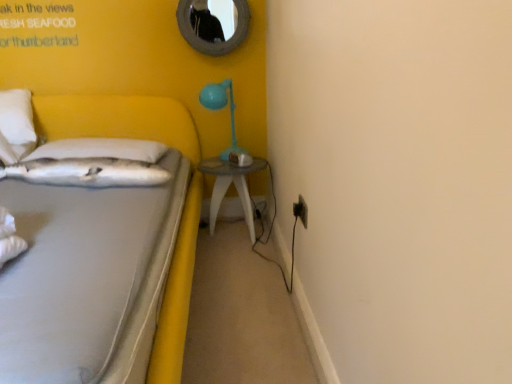
Find the location of a particular element. rounded silver mirror at upper center is located at coordinates (211, 27).

The width and height of the screenshot is (512, 384). What do you see at coordinates (183, 205) in the screenshot?
I see `white fabric bed at left` at bounding box center [183, 205].

The image size is (512, 384). What do you see at coordinates (229, 185) in the screenshot?
I see `clear glass table at center` at bounding box center [229, 185].

The width and height of the screenshot is (512, 384). Identify the location of black plastic electric outlet at lower right. (302, 211).

What are the coordinates of `white soft pillow at left, which is counted as the second pillow, starting from the back` in the screenshot? It's located at (87, 172).

What are the coordinates of `white soft pillow at left, the second pillow positioned from the front` in the screenshot? It's located at (101, 149).

Find the location of a particular element. rounded silver mirror at upper center is located at coordinates (211, 27).

Consider the image. What's the angular difference between white soft pillow at left, which ranks as the first pillow in back-to-front order, and rounded silver mirror at upper center's facing directions?

They differ by 9.39 degrees in their facing directions.

From the image's perspective, between white soft pillow at left, the second pillow positioned from the front, and rounded silver mirror at upper center, who is located below?

white soft pillow at left, the second pillow positioned from the front, from the image's perspective.

From a real-world perspective, between white soft pillow at left, which ranks as the first pillow in back-to-front order, and rounded silver mirror at upper center, who is vertically lower?

From a 3D spatial view, white soft pillow at left, which ranks as the first pillow in back-to-front order, is below.

Does point (101, 153) appear closer or farther from the camera than point (225, 50)?

Point (101, 153) appears to be closer to the viewer than point (225, 50).

From the image's perspective, would you say matte blue plastic table lamp at upper right is positioned over rounded silver mirror at upper center?

Actually, matte blue plastic table lamp at upper right appears below rounded silver mirror at upper center in the image.

Is matte blue plastic table lamp at upper right bigger or smaller than rounded silver mirror at upper center?

Clearly, matte blue plastic table lamp at upper right is larger in size than rounded silver mirror at upper center.

Considering the sizes of matte blue plastic table lamp at upper right and rounded silver mirror at upper center in the image, is matte blue plastic table lamp at upper right taller or shorter than rounded silver mirror at upper center?

Considering their sizes, matte blue plastic table lamp at upper right has more height than rounded silver mirror at upper center.

Is matte blue plastic table lamp at upper right outside of rounded silver mirror at upper center?

Indeed, matte blue plastic table lamp at upper right is completely outside rounded silver mirror at upper center.

Which is more distant, (x=266, y=161) or (x=306, y=213)?

The point (x=266, y=161) is farther from the camera.

Is clear glass table at center taller than black plastic electric outlet at lower right?

Yes, clear glass table at center is taller than black plastic electric outlet at lower right.

From a real-world perspective, is clear glass table at center on black plastic electric outlet at lower right?

Incorrect, from a real-world perspective, clear glass table at center is lower than black plastic electric outlet at lower right.

Would you consider clear glass table at center to be distant from black plastic electric outlet at lower right?

No, there isn't a large distance between clear glass table at center and black plastic electric outlet at lower right.

Considering the positions of objects rounded silver mirror at upper center and white fabric bed at left in the image provided, who is more to the left, rounded silver mirror at upper center or white fabric bed at left?

white fabric bed at left is more to the left.

How distant is rounded silver mirror at upper center from white fabric bed at left?

The distance of rounded silver mirror at upper center from white fabric bed at left is 51.14 centimeters.

From a real-world perspective, is rounded silver mirror at upper center positioned under white fabric bed at left based on gravity?

Actually, rounded silver mirror at upper center is physically above white fabric bed at left in the real world.

Which of these two, rounded silver mirror at upper center or white fabric bed at left, is smaller?

With smaller size is rounded silver mirror at upper center.

Considering the relative sizes of clear glass table at center and white soft pillow at left, which appears as the first pillow when viewed from the front, in the image provided, is clear glass table at center thinner than white soft pillow at left, which appears as the first pillow when viewed from the front,?

In fact, clear glass table at center might be wider than white soft pillow at left, which appears as the first pillow when viewed from the front.

How many degrees apart are the facing directions of clear glass table at center and white soft pillow at left, which appears as the first pillow when viewed from the front?

1.03 degrees separate the facing orientations of clear glass table at center and white soft pillow at left, which appears as the first pillow when viewed from the front.

From a real-world perspective, is clear glass table at center above or below white soft pillow at left, which is counted as the second pillow, starting from the back?

clear glass table at center is situated lower than white soft pillow at left, which is counted as the second pillow, starting from the back, in the real world.

Locate an element on the screen. the 2nd pillow in front of the clear glass table at center, counting from the anchor's position is located at coordinates (87, 172).

Who is shorter, matte blue plastic table lamp at upper right or white fabric bed at left?

With less height is matte blue plastic table lamp at upper right.

Could you tell me if matte blue plastic table lamp at upper right is turned towards white fabric bed at left?

No, matte blue plastic table lamp at upper right does not turn towards white fabric bed at left.

How many degrees apart are the facing directions of matte blue plastic table lamp at upper right and white fabric bed at left?

0.163 degrees.

Does matte blue plastic table lamp at upper right come in front of white fabric bed at left?

No, matte blue plastic table lamp at upper right is further to the viewer.

Choose the correct answer: Is black plastic electric outlet at lower right inside rounded silver mirror at upper center or outside it?

black plastic electric outlet at lower right is not enclosed by rounded silver mirror at upper center.

Does black plastic electric outlet at lower right have a larger size compared to rounded silver mirror at upper center?

Actually, black plastic electric outlet at lower right might be smaller than rounded silver mirror at upper center.

In the image, is black plastic electric outlet at lower right positioned in front of or behind rounded silver mirror at upper center?

Visually, black plastic electric outlet at lower right is located in front of rounded silver mirror at upper center.

What are the coordinates of `mirror on the left side of black plastic electric outlet at lower right` in the screenshot? It's located at (211, 27).

The width and height of the screenshot is (512, 384). Find the location of `mirror located above the white soft pillow at left, the second pillow positioned from the front (from the image's perspective)`. mirror located above the white soft pillow at left, the second pillow positioned from the front (from the image's perspective) is located at coordinates (211, 27).

There is a matte blue plastic table lamp at upper right. Where is `mirror above it (from a real-world perspective)`? This screenshot has width=512, height=384. mirror above it (from a real-world perspective) is located at coordinates point(211,27).

Estimate the real-world distances between objects in this image. Which object is further from matte blue plastic table lamp at upper right, clear glass table at center or black plastic electric outlet at lower right?

black plastic electric outlet at lower right is positioned further to the anchor matte blue plastic table lamp at upper right.

Which object lies further to the anchor point white soft pillow at left, the second pillow positioned from the front, white soft pillow at left, which appears as the first pillow when viewed from the front, or clear glass table at center?

clear glass table at center is positioned further to the anchor white soft pillow at left, the second pillow positioned from the front.

From the image, which object appears to be nearer to white soft pillow at left, which is counted as the second pillow, starting from the back, white fabric bed at left or rounded silver mirror at upper center?

white fabric bed at left lies closer to white soft pillow at left, which is counted as the second pillow, starting from the back, than the other object.

Estimate the real-world distances between objects in this image. Which object is closer to white soft pillow at left, the second pillow positioned from the front, black plastic electric outlet at lower right or white soft pillow at left, which is counted as the second pillow, starting from the back?

white soft pillow at left, which is counted as the second pillow, starting from the back.

Estimate the real-world distances between objects in this image. Which object is closer to clear glass table at center, white soft pillow at left, which appears as the first pillow when viewed from the front, or white soft pillow at left, which ranks as the first pillow in back-to-front order?

white soft pillow at left, which ranks as the first pillow in back-to-front order, lies closer to clear glass table at center than the other object.

When comparing their distances from clear glass table at center, does matte blue plastic table lamp at upper right or white fabric bed at left seem further?

A: The object further to clear glass table at center is white fabric bed at left.

Looking at the image, which one is located closer to black plastic electric outlet at lower right, white soft pillow at left, which ranks as the first pillow in back-to-front order, or matte blue plastic table lamp at upper right?

matte blue plastic table lamp at upper right is positioned closer to the anchor black plastic electric outlet at lower right.

From the image, which object appears to be farther from rounded silver mirror at upper center, matte blue plastic table lamp at upper right or white fabric bed at left?

Based on the image, white fabric bed at left appears to be further to rounded silver mirror at upper center.

Locate an element on the screen. This screenshot has height=384, width=512. table lamp that lies between rounded silver mirror at upper center and white soft pillow at left, which is counted as the second pillow, starting from the back, from top to bottom is located at coordinates (222, 108).

Where is `table lamp situated between white soft pillow at left, which appears as the first pillow when viewed from the front, and clear glass table at center from left to right`? This screenshot has height=384, width=512. table lamp situated between white soft pillow at left, which appears as the first pillow when viewed from the front, and clear glass table at center from left to right is located at coordinates (222, 108).

At what (x,y) coordinates should I click in order to perform the action: click on electric outlet between white fabric bed at left and clear glass table at center in the front-back direction. Please return your answer as a coordinate pair (x, y). Image resolution: width=512 pixels, height=384 pixels. Looking at the image, I should click on (302, 211).

Where is `nightstand between white soft pillow at left, which is counted as the second pillow, starting from the back, and black plastic electric outlet at lower right, in the horizontal direction`? nightstand between white soft pillow at left, which is counted as the second pillow, starting from the back, and black plastic electric outlet at lower right, in the horizontal direction is located at coordinates (229, 185).